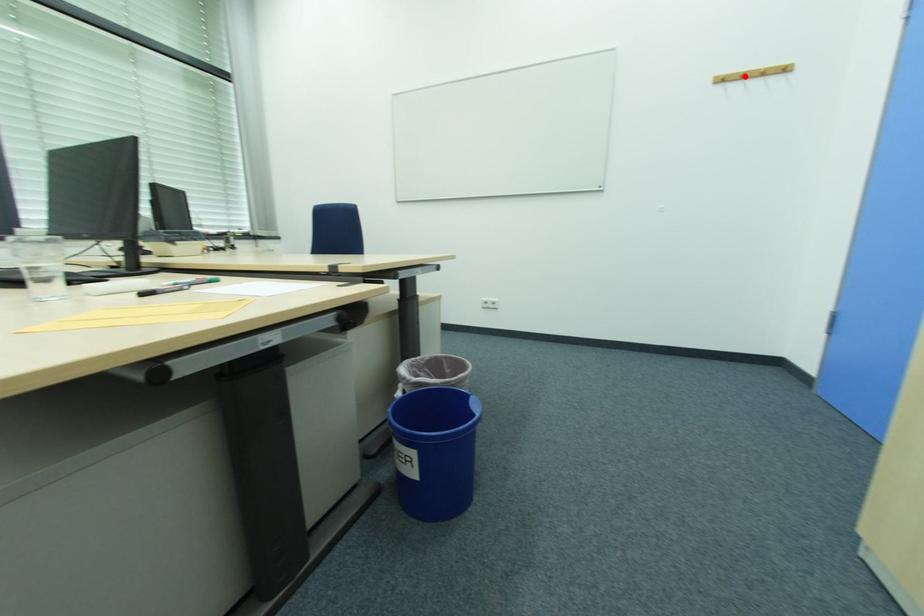
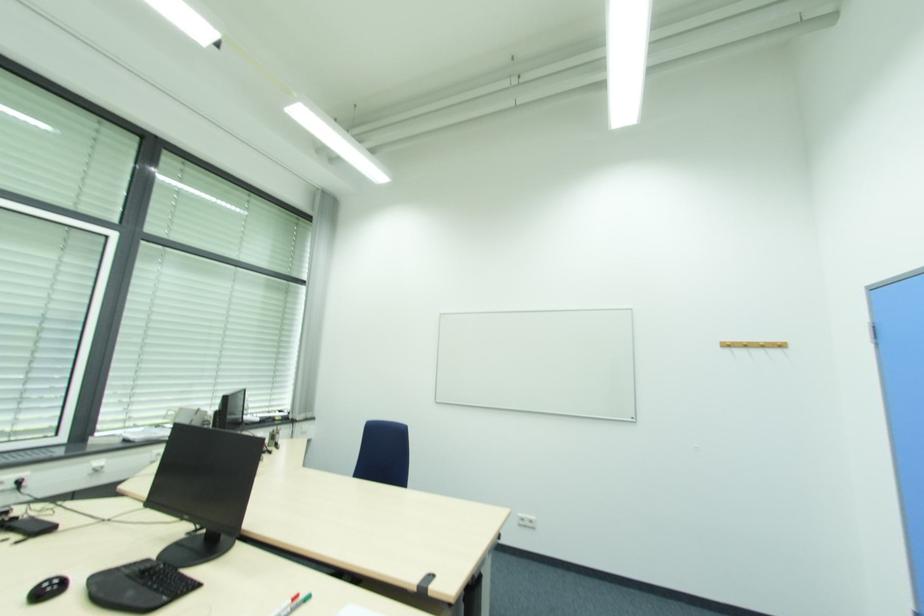
Locate, in the second image, the point that corresponds to the highlighted location in the first image.

(748, 346)